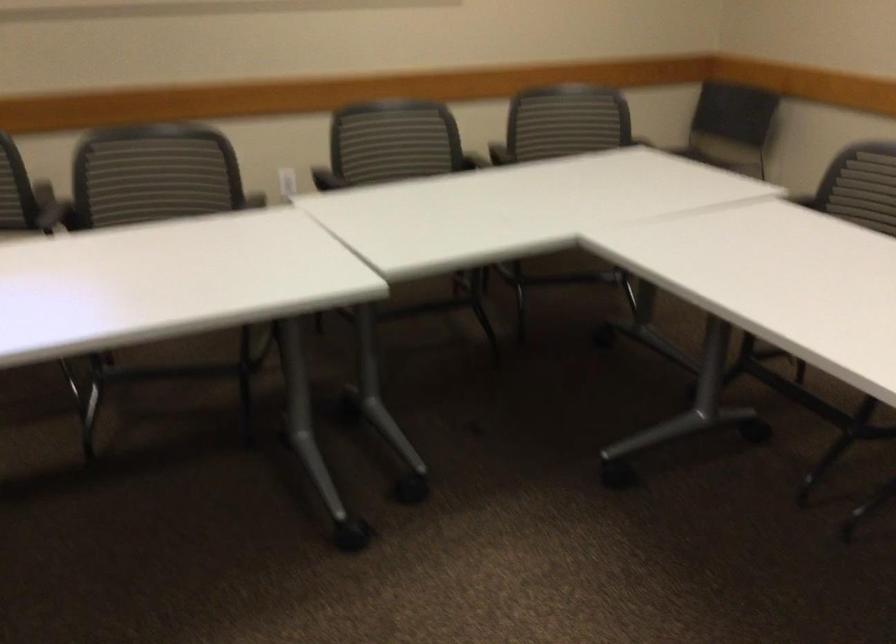
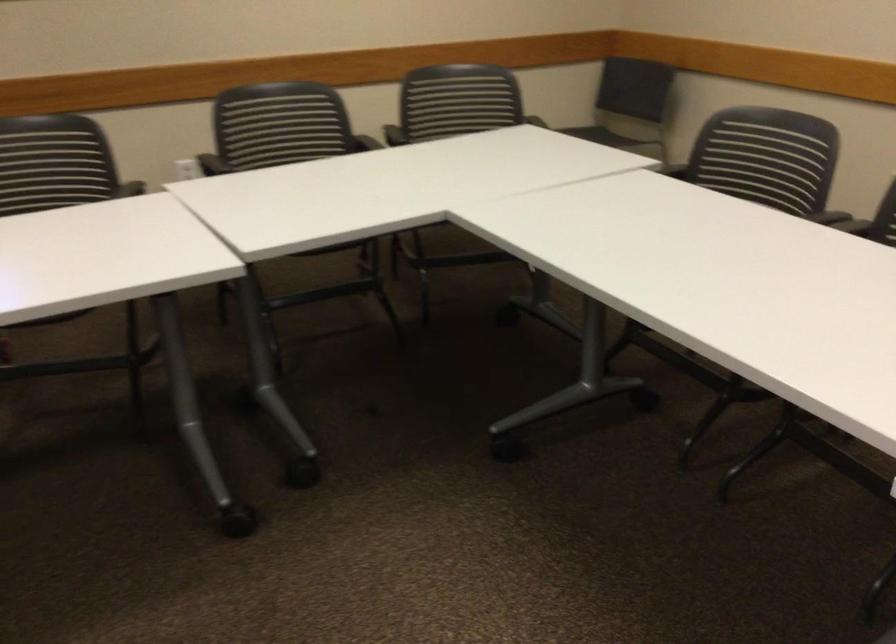
Question: I am providing you with two images of the same scene from different viewpoints. Please identify which objects are invisible in image2.

Choices:
 (A) chair sitting surface
 (B) black chair sitting surface
 (C) black chair armrest
 (D) clear glass sphere

Answer: (A)